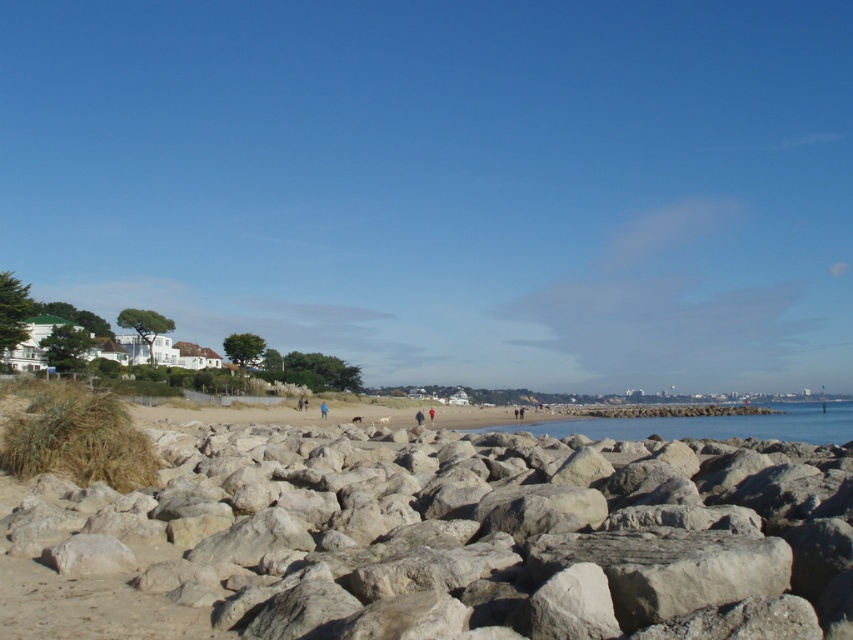
This screenshot has width=853, height=640. Find the location of `smooth gray rocks at center`. smooth gray rocks at center is located at coordinates (480, 541).

Which is above, clear blue water at center or blue fabric person at center?

Positioned higher is blue fabric person at center.

Which is behind, point (665, 433) or point (322, 412)?

Point (665, 433)

You are a GUI agent. You are given a task and a screenshot of the screen. Output one action in this format:
    pyautogui.click(x=<x>, y=<y>)
    Task: Click on the clear blue water at center
    This screenshot has width=853, height=640.
    Given the screenshot: What is the action you would take?
    pyautogui.click(x=708, y=426)

Is point (459, 625) closer to camera compared to point (672, 436)?

Yes.

Measure the distance between smooth gray rocks at center and camera.

A distance of 4.23 meters exists between smooth gray rocks at center and camera.

In the scene shown: Who is more forward, (514, 518) or (718, 419)?

Point (514, 518)

Find the location of a particular element. smooth gray rocks at center is located at coordinates (480, 541).